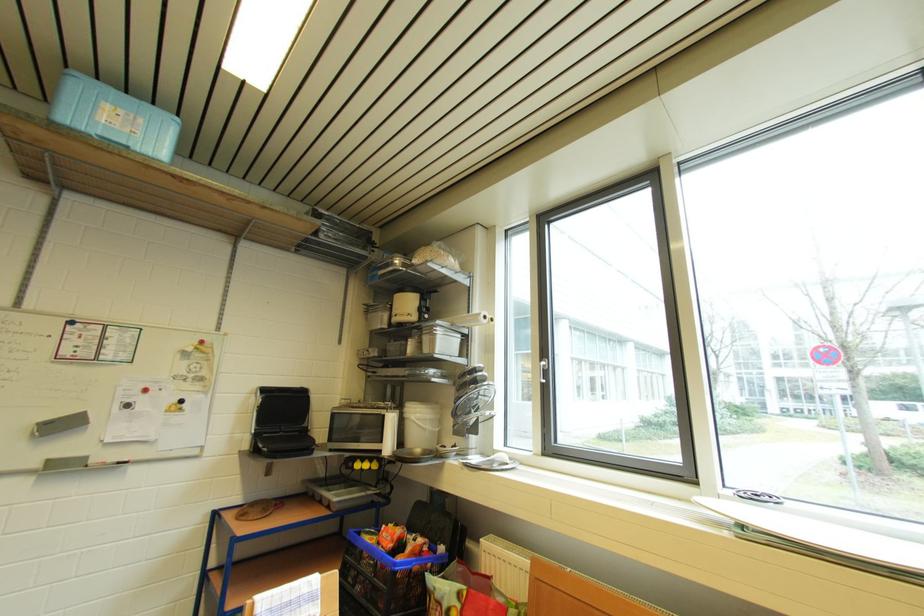
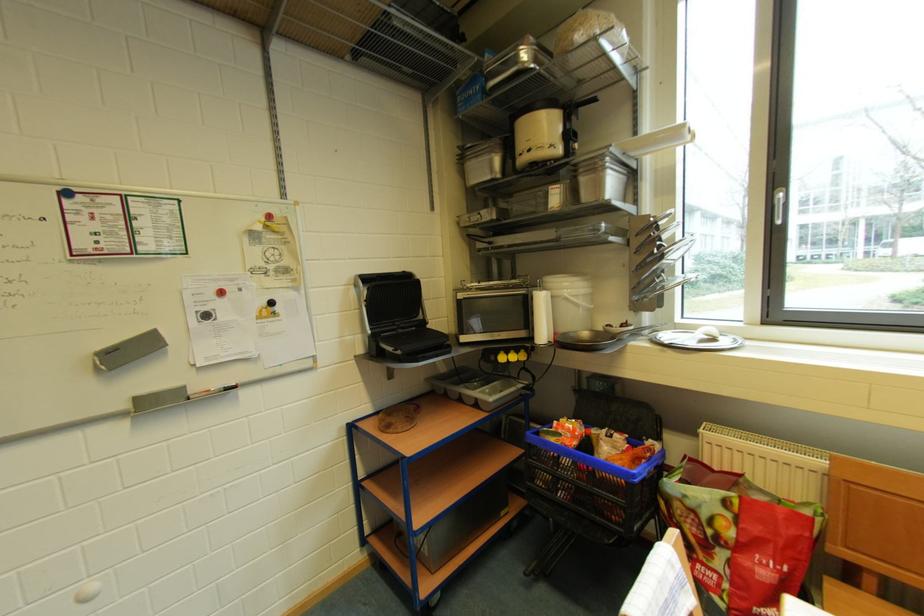
Find the pixel in the second image that matches the point at 431,334 in the first image.

(589, 174)